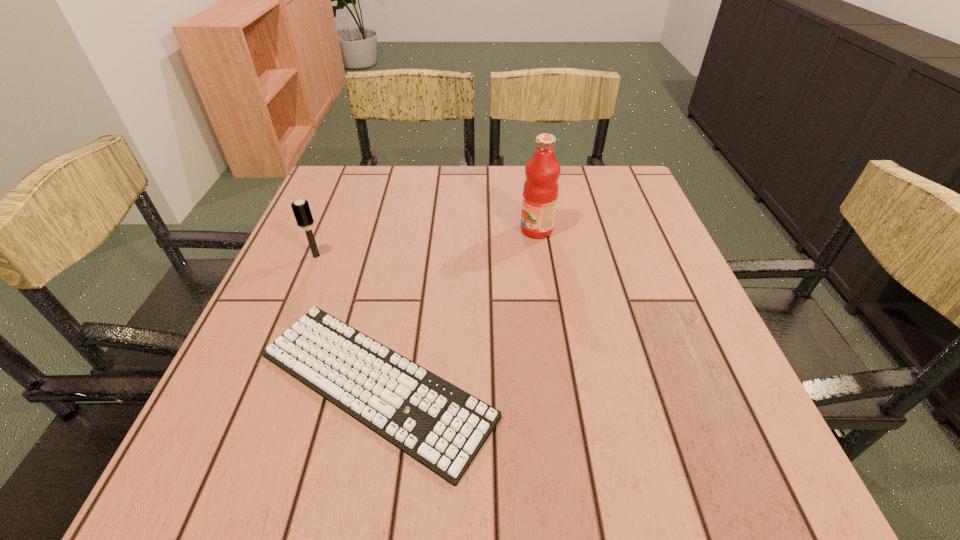
The height and width of the screenshot is (540, 960). In order to click on free point at the near right corner in this screenshot , I will do `click(685, 493)`.

Identify the location of free area in between the shortest object and the fruit juice. The image size is (960, 540). (456, 307).

Identify the location of vacant region between the fruit juice and the second nearest object. (426, 243).

Locate an element on the screen. This screenshot has width=960, height=540. vacant space in between the farthest object and the nearest object is located at coordinates (456, 307).

The height and width of the screenshot is (540, 960). I want to click on vacant point located between the second nearest object and the nearest object, so click(x=346, y=320).

Image resolution: width=960 pixels, height=540 pixels. What are the coordinates of `vacant area between the hairbrush and the computer keyboard` in the screenshot? It's located at (346, 320).

Locate an element on the screen. empty space between the shortest object and the fruit juice is located at coordinates (456, 307).

I want to click on free space between the second shortest object and the rightmost object, so click(x=426, y=243).

You are a GUI agent. You are given a task and a screenshot of the screen. Output one action in this format:
    pyautogui.click(x=<x>, y=<y>)
    Task: Click on the free space that is in between the hairbrush and the rightmost object
    
    Given the screenshot: What is the action you would take?
    pyautogui.click(x=426, y=243)

You are a GUI agent. You are given a task and a screenshot of the screen. Output one action in this format:
    pyautogui.click(x=<x>, y=<y>)
    Task: Click on the unoccupied area between the shortest object and the tallest object
    This screenshot has width=960, height=540.
    Given the screenshot: What is the action you would take?
    pyautogui.click(x=456, y=307)